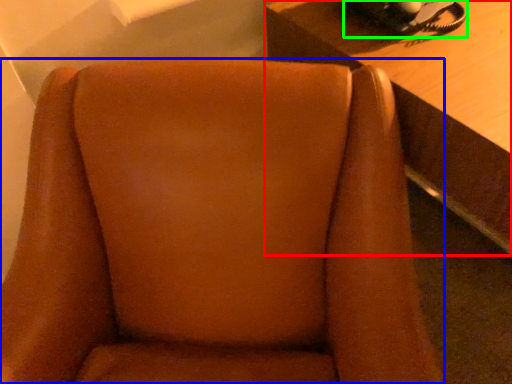
Question: Which object is positioned farthest from table (highlighted by a red box)? Select from chair (highlighted by a blue box) and corded phone (highlighted by a green box).

Choices:
 (A) chair
 (B) corded phone

Answer: (A)